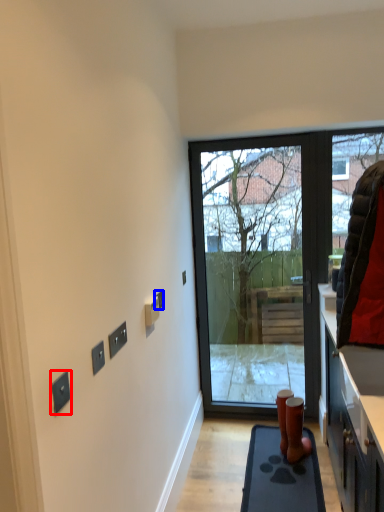
Question: Among these objects, which one is farthest to the camera, electric outlet (highlighted by a red box) or electric outlet (highlighted by a blue box)?

Choices:
 (A) electric outlet
 (B) electric outlet

Answer: (B)